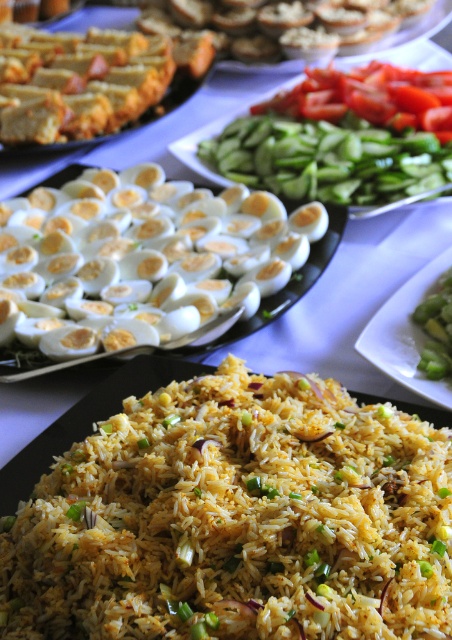
Which is more to the right, green crisp cucumber at center or green smoothsmoothvegetable at right?

From the viewer's perspective, green smoothsmoothvegetable at right appears more on the right side.

Is the position of green crisp cucumber at center less distant than that of green smoothsmoothvegetable at right?

No, it is not.

Who is more forward, (302, 195) or (409, 360)?

Point (409, 360) is more forward.

At what (x,y) coordinates should I click in order to perform the action: click on green crisp cucumber at center. Please return your answer as a coordinate pair (x, y). Image resolution: width=452 pixels, height=640 pixels. Looking at the image, I should click on (328, 160).

Can you confirm if white hard-boiled eggs at center is smaller than green smoothsmoothvegetable at right?

Incorrect, white hard-boiled eggs at center is not smaller in size than green smoothsmoothvegetable at right.

Is point (93, 188) more distant than point (424, 291)?

Yes, point (93, 188) is behind point (424, 291).

At what (x,y) coordinates should I click in order to perform the action: click on white hard-boiled eggs at center. Please return your answer as a coordinate pair (x, y). Image resolution: width=452 pixels, height=640 pixels. Looking at the image, I should click on (150, 246).

Is crusty bread at upper center smaller than green smoothsmoothvegetable at right?

No, crusty bread at upper center is not smaller than green smoothsmoothvegetable at right.

What do you see at coordinates (282, 24) in the screenshot?
I see `crusty bread at upper center` at bounding box center [282, 24].

The width and height of the screenshot is (452, 640). What are the coordinates of `crusty bread at upper center` in the screenshot? It's located at [x=282, y=24].